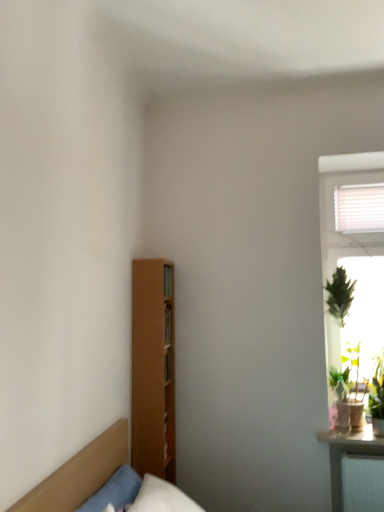
What do you see at coordinates (79, 474) in the screenshot?
I see `brown matte headboard at left` at bounding box center [79, 474].

You are a GUI agent. You are given a task and a screenshot of the screen. Output one action in this format:
    pyautogui.click(x=<x>, y=<y>)
    Task: Click on the brown matte headboard at left
    This screenshot has height=512, width=384.
    Given the screenshot: What is the action you would take?
    pyautogui.click(x=79, y=474)

The width and height of the screenshot is (384, 512). What do you see at coordinates (353, 440) in the screenshot? I see `green leafy plant at right` at bounding box center [353, 440].

Identify the location of green leafy plant at right. This screenshot has height=512, width=384. point(353,440).

I want to click on brown matte headboard at left, so click(x=79, y=474).

Considering the positions of objects green leafy plant at right and brown matte headboard at left in the image provided, who is more to the right, green leafy plant at right or brown matte headboard at left?

green leafy plant at right is more to the right.

Is green leafy plant at right behind brown matte headboard at left?

That is True.

Is point (369, 438) more distant than point (123, 462)?

Yes.

From the picture: From the image's perspective, is green leafy plant at right on brown matte headboard at left?

No, from the image's perspective, green leafy plant at right is not over brown matte headboard at left.

From a real-world perspective, which object stands above the other?

green leafy plant at right, from a real-world perspective.

Is green leafy plant at right thinner than brown matte headboard at left?

In fact, green leafy plant at right might be wider than brown matte headboard at left.

Is green leafy plant at right shorter than brown matte headboard at left?

Yes.

Can you confirm if green leafy plant at right is bigger than brown matte headboard at left?

Actually, green leafy plant at right might be smaller than brown matte headboard at left.

Would you say green leafy plant at right contains brown matte headboard at left?

No, brown matte headboard at left is located outside of green leafy plant at right.

Are green leafy plant at right and brown matte headboard at left making contact?

green leafy plant at right and brown matte headboard at left are not in contact.

Is green leafy plant at right positioned with its back to brown matte headboard at left?

No, brown matte headboard at left is not at the back of green leafy plant at right.

Locate an element on the screen. window sill lying below the brown matte headboard at left (from the image's perspective) is located at coordinates (353, 440).

Considering the relative positions of brown matte headboard at left and green leafy plant at right in the image provided, is brown matte headboard at left to the left of green leafy plant at right from the viewer's perspective?

Yes, brown matte headboard at left is to the left of green leafy plant at right.

Considering their positions, is brown matte headboard at left located in front of or behind green leafy plant at right?

In the image, brown matte headboard at left appears in front of green leafy plant at right.

Which point is more forward, (60,490) or (375,444)?

The point (60,490) is more forward.

From the image's perspective, which one is positioned higher, brown matte headboard at left or green leafy plant at right?

brown matte headboard at left.

From a real-world perspective, between brown matte headboard at left and green leafy plant at right, who is vertically higher?

green leafy plant at right.

Which object is thinner, brown matte headboard at left or green leafy plant at right?

Thinner between the two is brown matte headboard at left.

In terms of height, does brown matte headboard at left look taller or shorter compared to green leafy plant at right?

In the image, brown matte headboard at left appears to be taller than green leafy plant at right.

Can you confirm if brown matte headboard at left is smaller than green leafy plant at right?

Actually, brown matte headboard at left might be larger than green leafy plant at right.

Is brown matte headboard at left not within green leafy plant at right?

Yes, brown matte headboard at left is not within green leafy plant at right.

Is brown matte headboard at left not near green leafy plant at right?

Absolutely, brown matte headboard at left is distant from green leafy plant at right.

Is brown matte headboard at left looking in the opposite direction of green leafy plant at right?

No.

You are a GUI agent. You are given a task and a screenshot of the screen. Output one action in this format:
    pyautogui.click(x=<x>, y=<y>)
    Task: Click on the window sill located on the right of brown matte headboard at left
    This screenshot has height=512, width=384.
    Given the screenshot: What is the action you would take?
    pyautogui.click(x=353, y=440)

In order to click on window sill that is above the brown matte headboard at left (from a real-world perspective) in this screenshot , I will do `click(353, 440)`.

The image size is (384, 512). What are the coordinates of `furniture that is on the left side of green leafy plant at right` in the screenshot? It's located at [x=79, y=474].